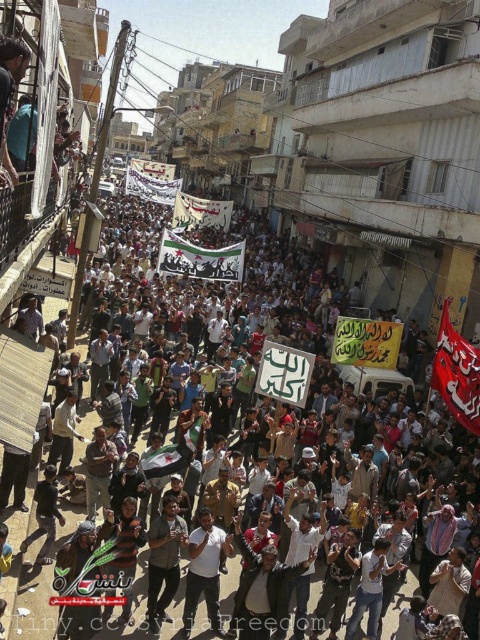
You are a photographer standing at the edge of the crowd. You want to take a photo that includes both the white paper signs at center and the white cotton shirt at center. Given the distance between them, will you be able to frame both in a single shot without moving your position?

The distance between the white paper signs at center and the white cotton shirt at center is 116.36 feet. Since this distance is quite large, it may be challenging to frame both in a single shot without moving your position. A wide angle lens might help, but the feasibility depends on your camera settings and the zoom capabilities.

You are a photographer at the protest. You want to take a photo that includes both the white paper signs at center and the white shirt at center. Which object should you focus on first to ensure both are in the frame?

The white paper signs at center is above the white shirt at center, so you should focus on the white shirt at center first to ensure both are in the frame.